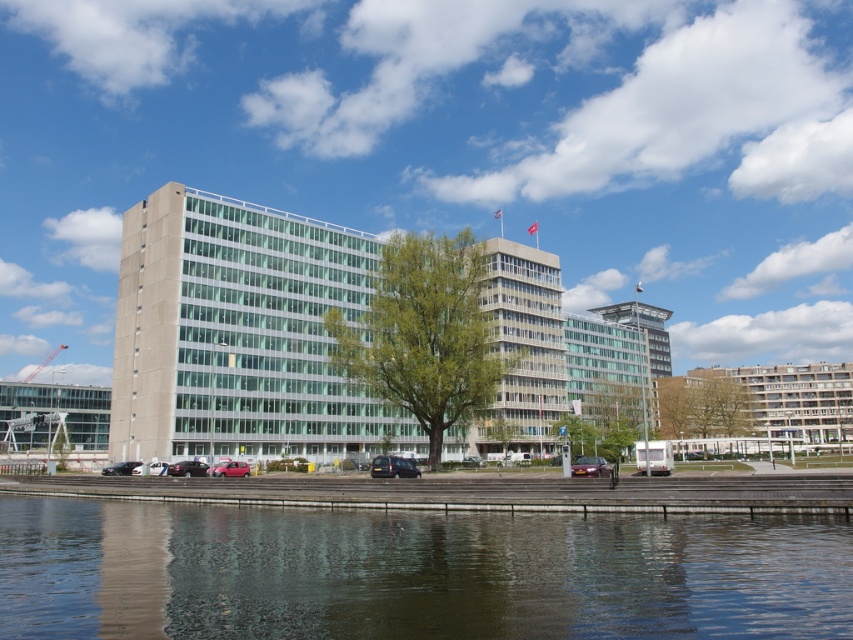
Is metallic purple car at center shorter than shiny black sedan at lower left?

In fact, metallic purple car at center may be taller than shiny black sedan at lower left.

What do you see at coordinates (590, 467) in the screenshot? I see `metallic purple car at center` at bounding box center [590, 467].

Does point (608, 470) come closer to viewer compared to point (173, 468)?

Yes, it is in front of point (173, 468).

The image size is (853, 640). In order to click on metallic purple car at center in this screenshot , I will do `click(590, 467)`.

Between dark gray matte car at center and shiny silver car at lower left, which one appears on the left side from the viewer's perspective?

From the viewer's perspective, shiny silver car at lower left appears more on the left side.

Is point (376, 467) behind point (161, 474)?

No, it is in front of (161, 474).

Is point (408, 458) closer to camera compared to point (155, 474)?

No, it is not.

Locate an element on the screen. The width and height of the screenshot is (853, 640). dark gray matte car at center is located at coordinates (393, 467).

Consider the image. Who is more forward, (378, 461) or (123, 467)?

Point (378, 461)

Is the position of dark gray matte car at center more distant than that of matte black car at lower left?

No, it is in front of matte black car at lower left.

What do you see at coordinates (393, 467) in the screenshot?
I see `dark gray matte car at center` at bounding box center [393, 467].

You are a GUI agent. You are given a task and a screenshot of the screen. Output one action in this format:
    pyautogui.click(x=<x>, y=<y>)
    Task: Click on the dark gray matte car at center
    The width and height of the screenshot is (853, 640).
    Given the screenshot: What is the action you would take?
    pyautogui.click(x=393, y=467)